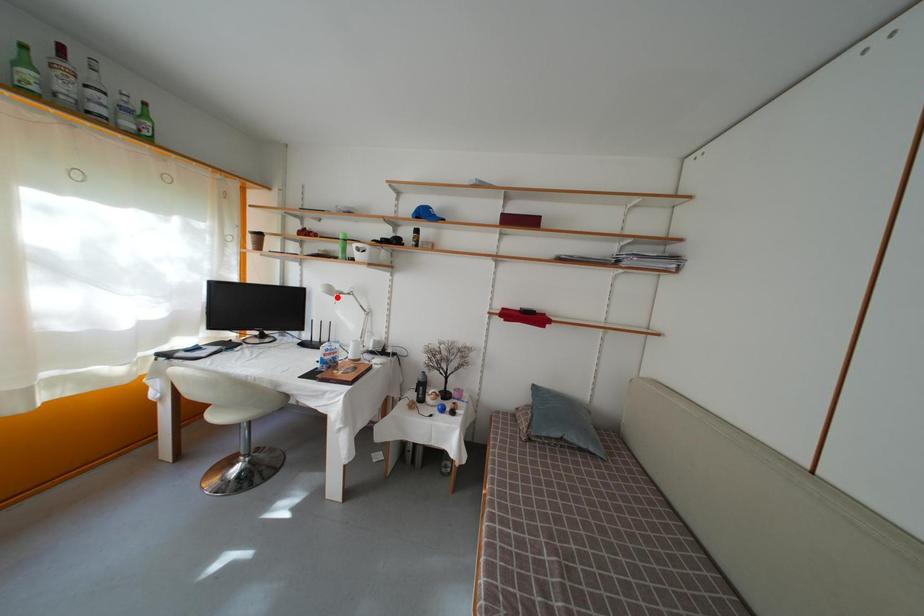
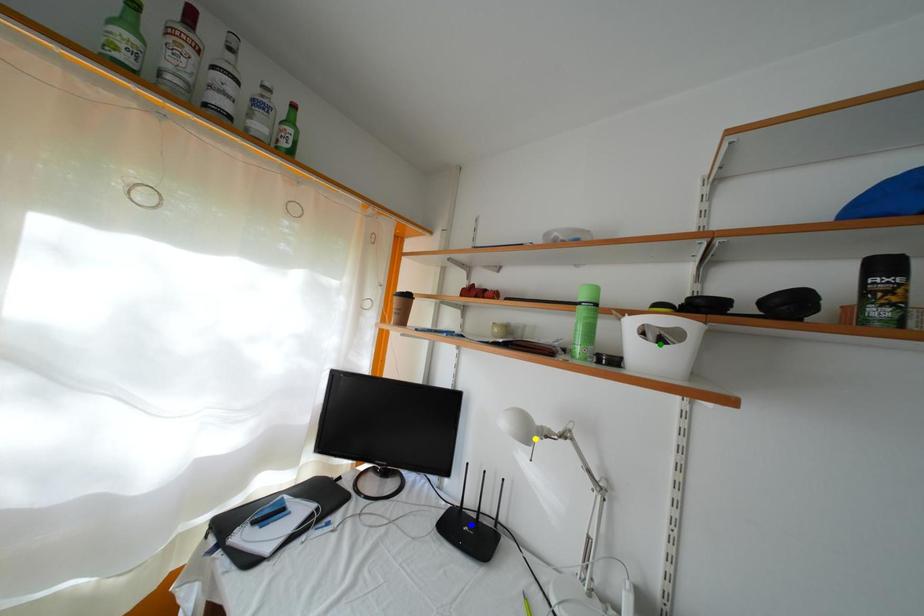
Question: I am providing you with two images of the same scene from different viewpoints. A red point is marked on the first image. You are given multiple points on the second image. Which point in image 2 represents the same 3d spot as the red point in image 1?

Choices:
 (A) yellow point
 (B) blue point
 (C) green point

Answer: (A)